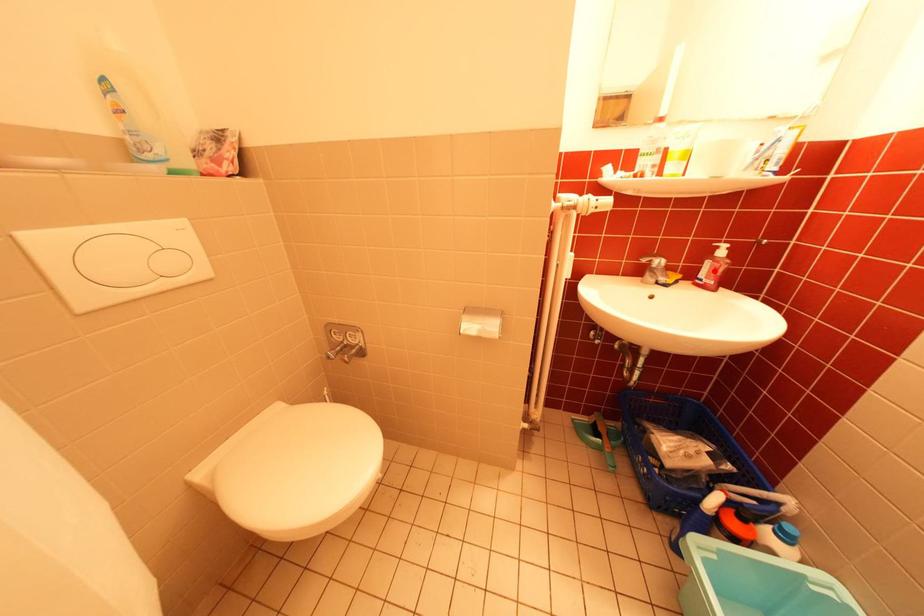
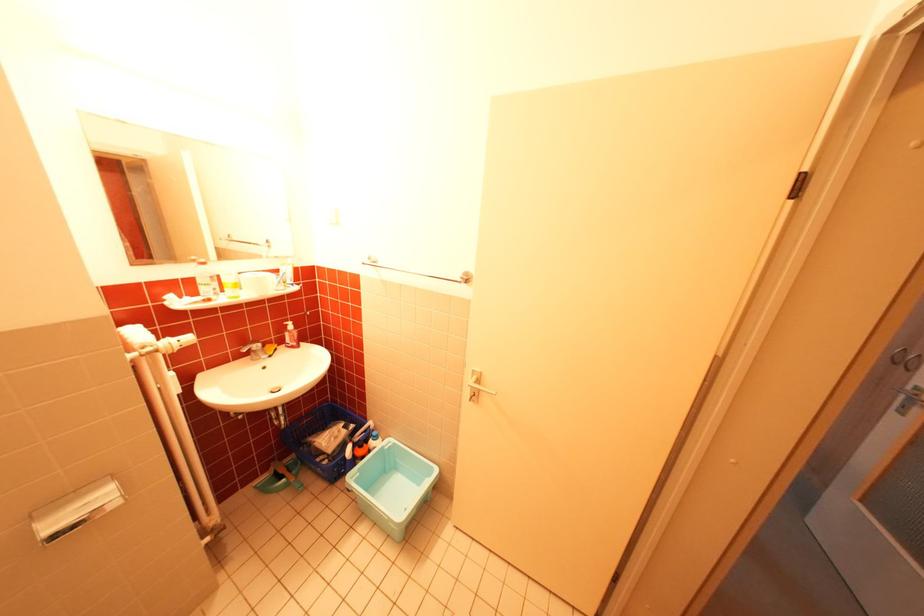
Locate, in the second image, the point that corresponds to the highlighted location in the first image.

(298, 339)